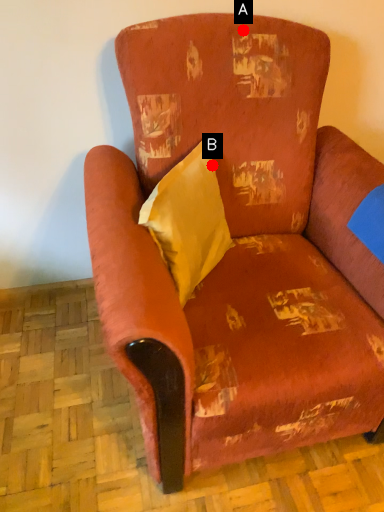
Question: Two points are circled on the image, labeled by A and B beside each circle. Which point is further to the camera?

Choices:
 (A) A is further
 (B) B is further

Answer: (B)